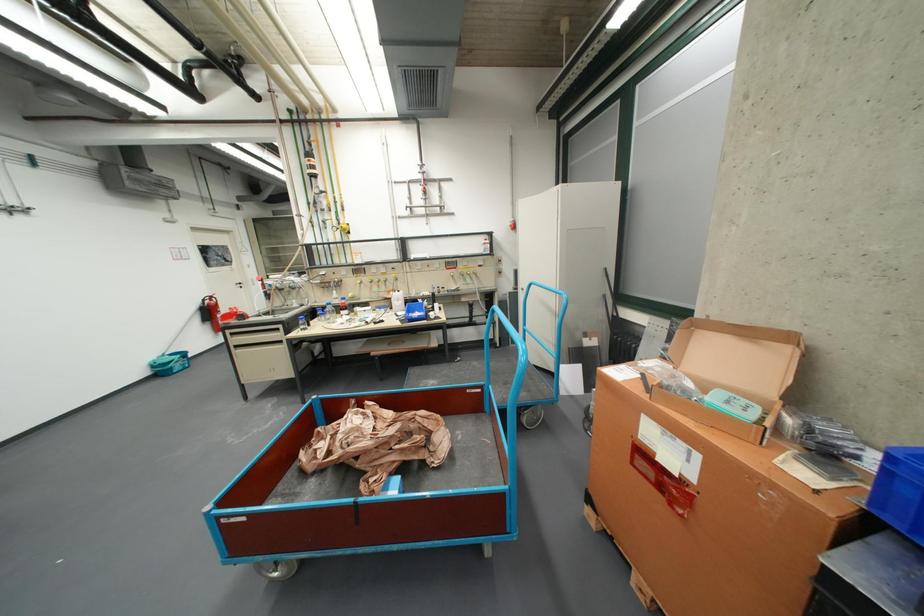
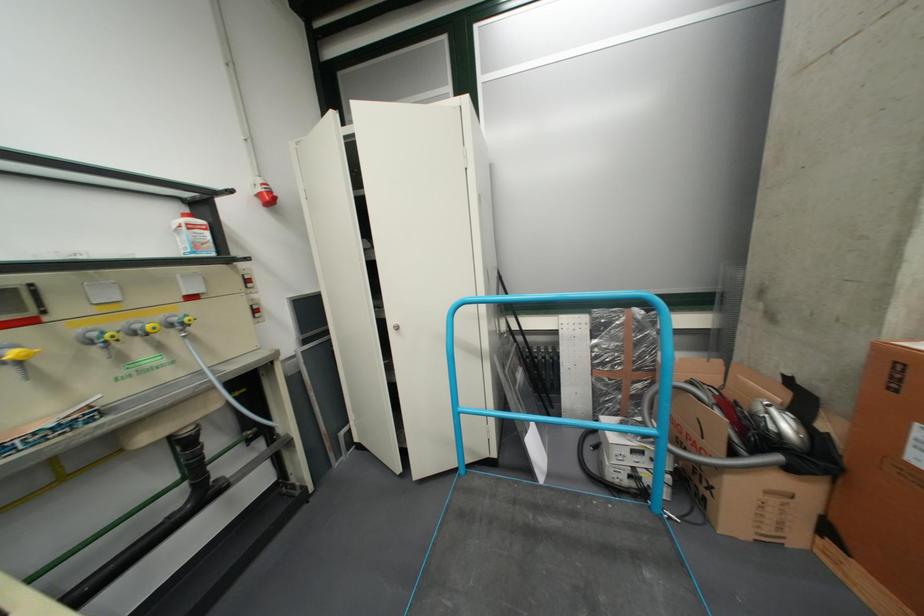
In the second image, find the point that corresponds to point (520, 223) in the first image.

(260, 185)